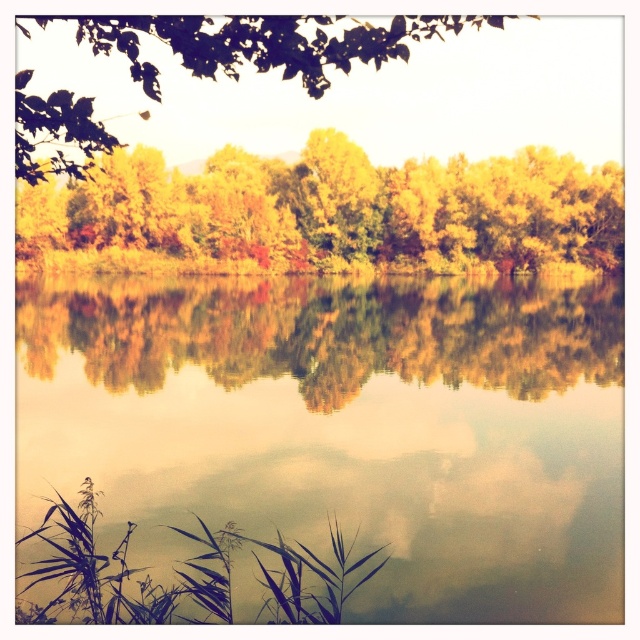
Which is behind, point (208, 225) or point (13, 22)?

The point (208, 225) is behind.

Does point (118, 244) lie behind point (61, 17)?

Yes, point (118, 244) is behind point (61, 17).

Identify the location of yellow-green leaves at center. (326, 212).

Can you confirm if golden reflective water at center is taller than green leafy tree at upper center?

Incorrect, golden reflective water at center's height is not larger of green leafy tree at upper center's.

Can you confirm if golden reflective water at center is smaller than green leafy tree at upper center?

Yes.

Is point (464, 284) closer to camera compared to point (387, 45)?

That is False.

Find the location of a particular element. golden reflective water at center is located at coordinates (326, 332).

Who is more distant from viewer, [380,435] or [490,326]?

The point [490,326] is behind.

Does point (416, 304) lie behind point (248, 317)?

Yes, it is behind point (248, 317).

Is point (237, 401) behind point (316, 355)?

That is False.

This screenshot has height=640, width=640. In order to click on smooth reflective water at center in this screenshot , I will do `click(346, 428)`.